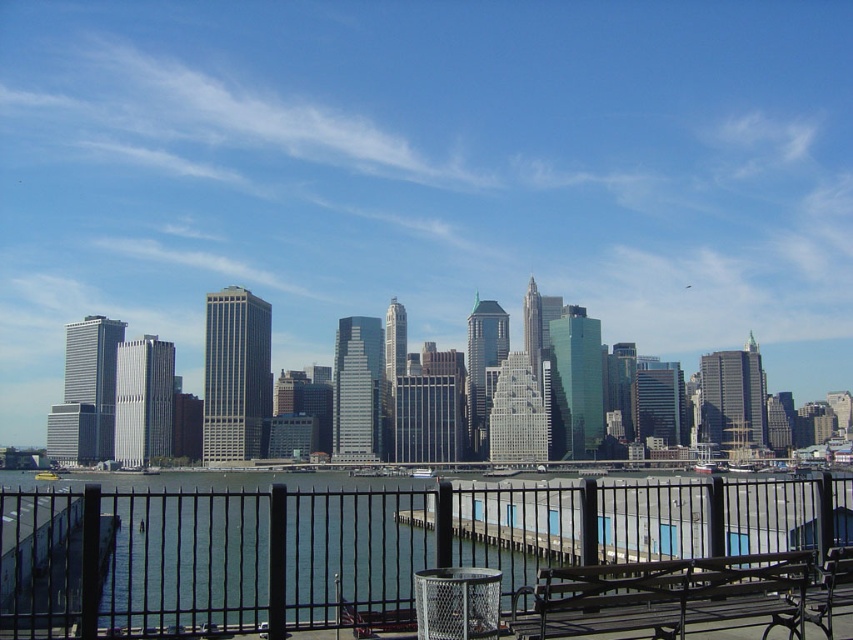
Question: Which object is closer to the camera taking this photo?

Choices:
 (A) clear water at lower center
 (B) brown wooden bench at lower right

Answer: (B)

Question: Which object appears closest to the camera in this image?

Choices:
 (A) brown wooden bench at lower right
 (B) clear water at lower center

Answer: (A)

Question: Which point appears closest to the camera in this image?

Choices:
 (A) (502, 586)
 (B) (764, 584)

Answer: (B)

Question: Can you confirm if clear water at lower center is smaller than brown wooden bench at lower right?

Choices:
 (A) no
 (B) yes

Answer: (A)

Question: Is clear water at lower center above brown wooden bench at lower right?

Choices:
 (A) no
 (B) yes

Answer: (A)

Question: Is clear water at lower center positioned before brown wooden bench at lower right?

Choices:
 (A) no
 (B) yes

Answer: (A)